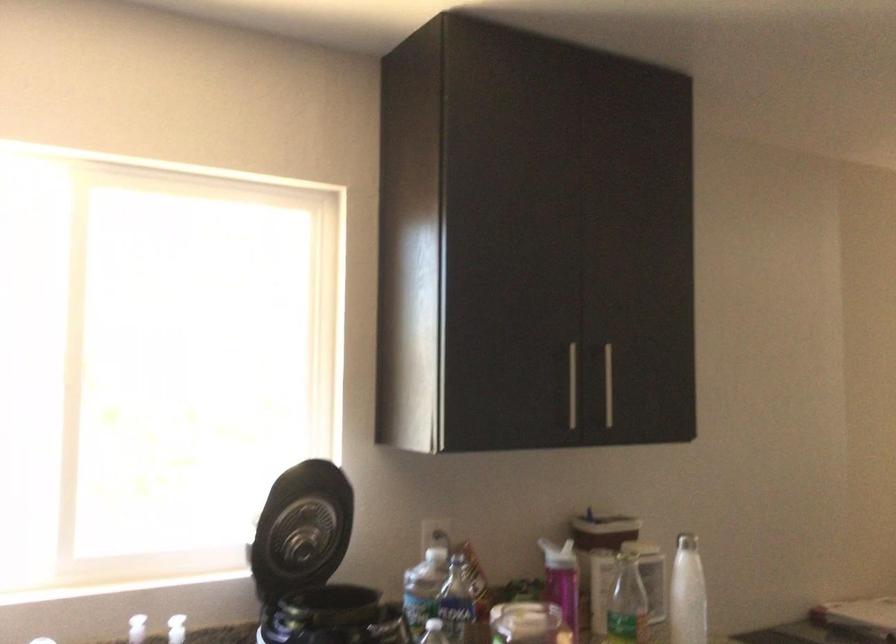
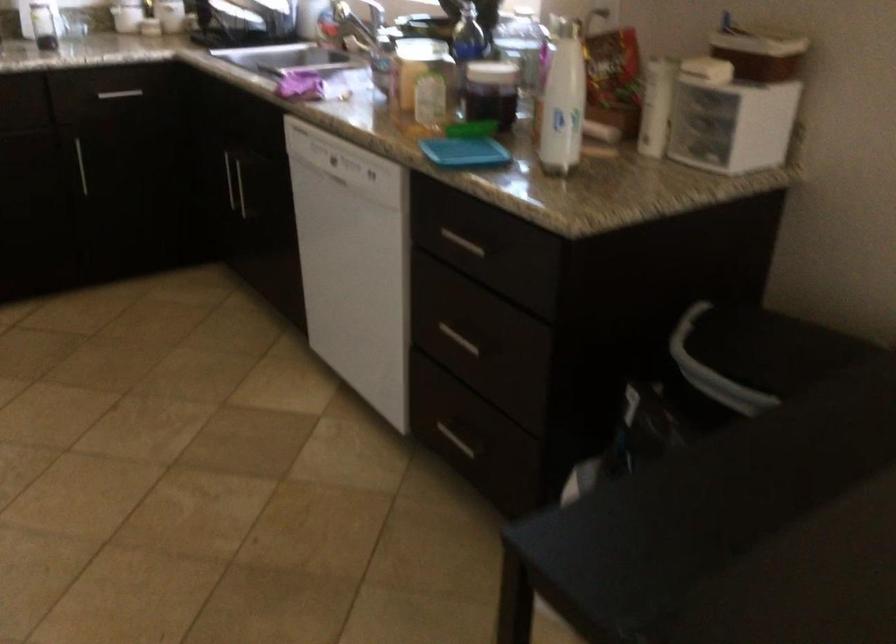
Question: I am providing you with two images of the same scene from different viewpoints. Which of the following objects are not visible in image2?

Choices:
 (A) yellow folder pull
 (B) white bottle
 (C) purple jam jar
 (D) silver cabinet handle

Answer: (B)